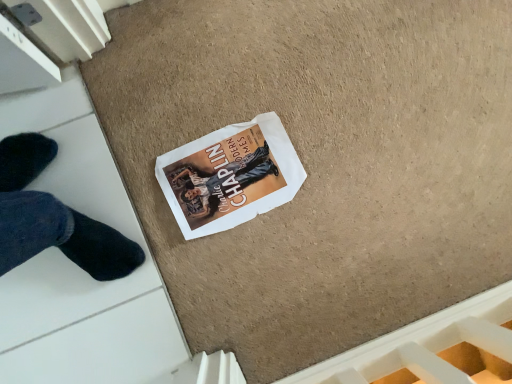
Identify the location of free region on the left part of white paper magazine at center. This screenshot has height=384, width=512. (158, 112).